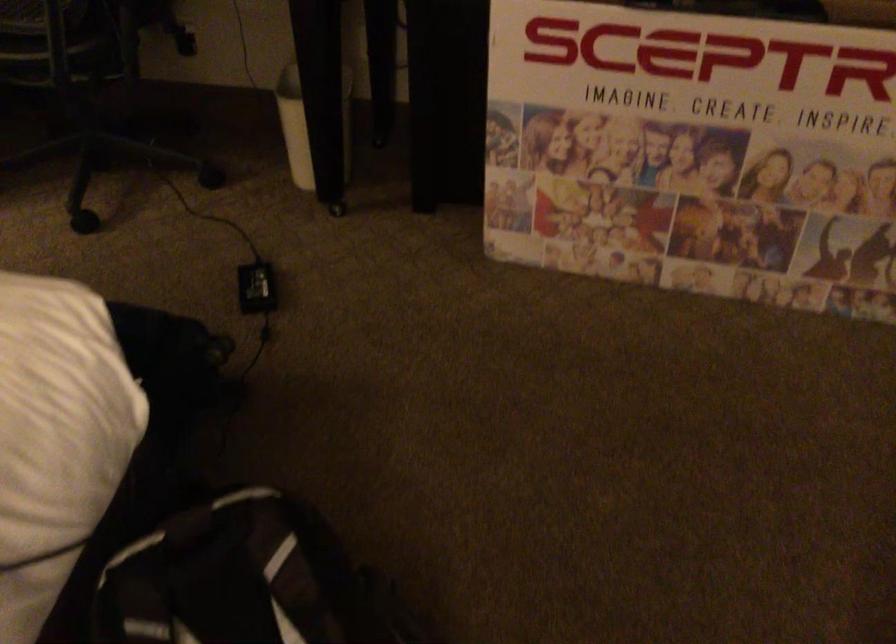
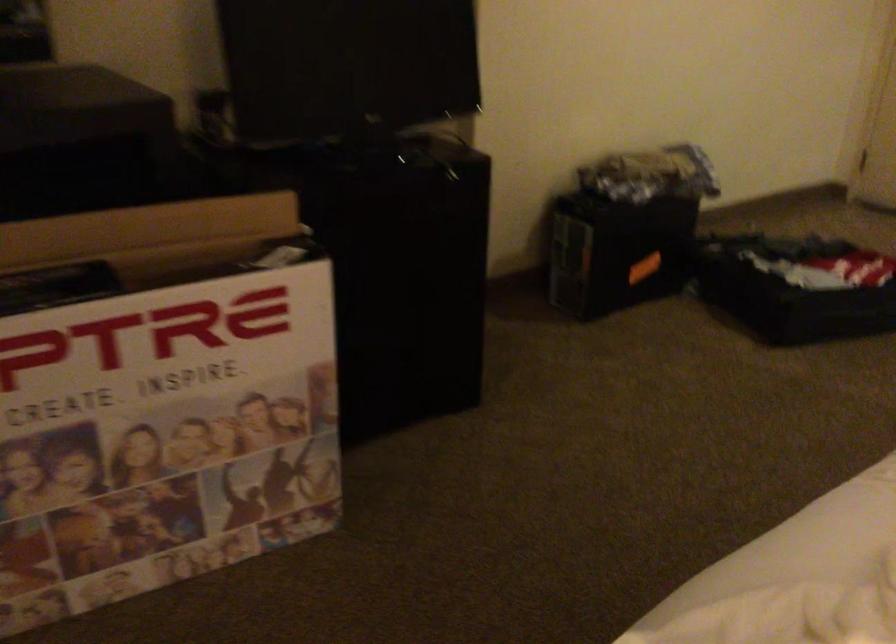
Locate, in the second image, the point that corresponds to point 820,124 in the first image.

(171, 393)